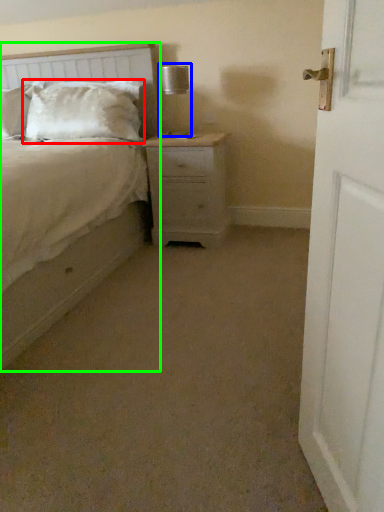
Question: Based on their relative distances, which object is farther from pillow (highlighted by a red box)? Choose from table lamp (highlighted by a blue box) and bed (highlighted by a green box).

Choices:
 (A) table lamp
 (B) bed

Answer: (B)